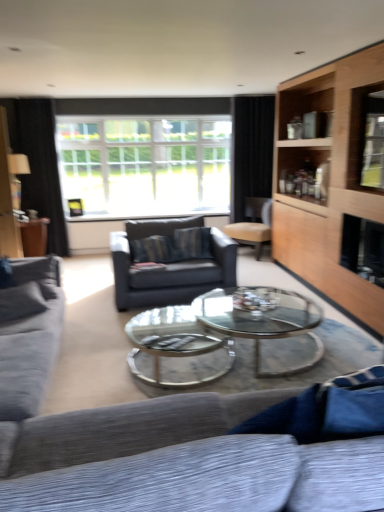
What do you see at coordinates (147, 126) in the screenshot? This screenshot has width=384, height=512. I see `clear glass window at center` at bounding box center [147, 126].

Identify the location of textured gray couch at left, arranged as the 1th studio couch when viewed from the left. (29, 334).

How much space does textured gray couch at lower center, which is the second studio couch in left-to-right order, occupy vertically?

The height of textured gray couch at lower center, which is the second studio couch in left-to-right order, is 31.72 inches.

How much space does textured gray couch at lower center, which is the first studio couch in right-to-left order, occupy horizontally?

textured gray couch at lower center, which is the first studio couch in right-to-left order, is 3.96 feet wide.

Locate an element on the screen. This screenshot has width=384, height=512. clear glass window at center is located at coordinates (147, 126).

How distant is black fabric curtain at left, which is the 1th curtain from left to right, from clear glass window at center?

3.49 feet.

From a real-world perspective, between black fabric curtain at left, the second curtain when ordered from right to left, and clear glass window at center, who is vertically lower?

black fabric curtain at left, the second curtain when ordered from right to left.

Between black fabric curtain at left, which is the 1th curtain from left to right, and clear glass window at center, which one has larger width?

clear glass window at center.

From the image's perspective, is black fabric curtain at left, the second curtain when ordered from right to left, above or below clear glass window at center?

Clearly, from the image's perspective, black fabric curtain at left, the second curtain when ordered from right to left, is below clear glass window at center.

Can you confirm if light wood cabinet at right is thinner than black fabric curtain at left, the second curtain when ordered from right to left?

No.

What's the angular difference between light wood cabinet at right and black fabric curtain at left, which is the 1th curtain from left to right,'s facing directions?

The angular difference between light wood cabinet at right and black fabric curtain at left, which is the 1th curtain from left to right, is 90.7 degrees.

From their relative heights in the image, would you say light wood cabinet at right is taller or shorter than black fabric curtain at left, which is the 1th curtain from left to right?

light wood cabinet at right is taller than black fabric curtain at left, which is the 1th curtain from left to right.

Can you confirm if textured gray couch at lower center, which is the second studio couch in left-to-right order, is bigger than clear glass window at center?

Yes, textured gray couch at lower center, which is the second studio couch in left-to-right order, is bigger than clear glass window at center.

Could you tell me if textured gray couch at lower center, which is the first studio couch in right-to-left order, is facing clear glass window at center?

Yes, textured gray couch at lower center, which is the first studio couch in right-to-left order, is facing clear glass window at center.

Can you confirm if textured gray couch at lower center, which is the second studio couch in left-to-right order, is thinner than clear glass window at center?

Incorrect, the width of textured gray couch at lower center, which is the second studio couch in left-to-right order, is not less than that of clear glass window at center.

Is the depth of textured gray couch at lower center, which is the second studio couch in left-to-right order, less than that of clear glass window at center?

Yes, it is.

Can you tell me how much black fabric curtain at left, which is the 1th curtain from left to right, and textured gray couch at left, arranged as the 1th studio couch when viewed from the left, differ in facing direction?

The angular difference between black fabric curtain at left, which is the 1th curtain from left to right, and textured gray couch at left, arranged as the 1th studio couch when viewed from the left, is 89.6 degrees.

Which curtain is the 1st one when counting from the back of the textured gray couch at left, arranged as the 1th studio couch when viewed from the left? Please provide its 2D coordinates.

[(39, 164)]

Is black fabric curtain at left, the second curtain when ordered from right to left, facing towards textured gray couch at left, arranged as the 1th studio couch when viewed from the left?

Yes, black fabric curtain at left, the second curtain when ordered from right to left, is turned towards textured gray couch at left, arranged as the 1th studio couch when viewed from the left.

Based on the photo, would you say black fabric curtain at left, the second curtain when ordered from right to left, is to the left or to the right of textured gray couch at left, the 2th studio couch viewed from the right, in the picture?

black fabric curtain at left, the second curtain when ordered from right to left, is positioned on textured gray couch at left, the 2th studio couch viewed from the right,'s left side.

Which object is wider, light wood cabinet at right or textured gray couch at lower center, which is the second studio couch in left-to-right order?

textured gray couch at lower center, which is the second studio couch in left-to-right order.

From a real-world perspective, relative to textured gray couch at lower center, which is the second studio couch in left-to-right order, is light wood cabinet at right vertically above or below?

light wood cabinet at right is situated higher than textured gray couch at lower center, which is the second studio couch in left-to-right order, in the real world.

Is point (380, 313) positioned before point (249, 490)?

No, it is not.

Between point (249, 219) and point (240, 288), which one is positioned behind?

The point (249, 219) is farther from the camera.

Consider the image. Is the position of black fabric curtain at upper right, which ranks as the 2th curtain in left-to-right order, less distant than that of clear glass coffee table at center?

No, black fabric curtain at upper right, which ranks as the 2th curtain in left-to-right order, is further to the viewer.

How many degrees apart are the facing directions of black fabric curtain at upper right, which ranks as the 2th curtain in left-to-right order, and clear glass coffee table at center?

They differ by 92.5 degrees in their facing directions.

I want to click on the 2nd curtain positioned above the clear glass coffee table at center (from a real-world perspective), so click(x=251, y=151).

Is textured gray couch at lower center, which is the first studio couch in right-to-left order, at the back of clear glass window at center?

clear glass window at center is not turned away from textured gray couch at lower center, which is the first studio couch in right-to-left order.

Is point (113, 99) less distant than point (107, 459)?

No.

Can you confirm if clear glass window at center is positioned to the right of textured gray couch at lower center, which is the first studio couch in right-to-left order?

No.

Can you confirm if clear glass window at center is thinner than textured gray couch at lower center, which is the second studio couch in left-to-right order?

Indeed, clear glass window at center has a lesser width compared to textured gray couch at lower center, which is the second studio couch in left-to-right order.

Find the location of a particular element. This screenshot has height=512, width=384. window on the right of black fabric curtain at left, which is the 1th curtain from left to right is located at coordinates (147, 126).

At what (x,y) coordinates should I click in order to perform the action: click on curtain that is the 2nd one when counting leftward from the light wood cabinet at right. Please return your answer as a coordinate pair (x, y). Looking at the image, I should click on (39, 164).

When comparing their distances from textured gray couch at left, arranged as the 1th studio couch when viewed from the left, does clear glass coffee table at center or dark gray fabric swivel chair at center seem closer?

clear glass coffee table at center is closer to textured gray couch at left, arranged as the 1th studio couch when viewed from the left.

Looking at this image, when comparing their distances from light wood cabinet at right, does black fabric curtain at left, the second curtain when ordered from right to left, or textured gray couch at left, arranged as the 1th studio couch when viewed from the left, seem further?

The object further to light wood cabinet at right is black fabric curtain at left, the second curtain when ordered from right to left.

In the scene shown: When comparing their distances from textured gray couch at left, the 2th studio couch viewed from the right, does light wood cabinet at right or beige leather chair at center seem closer?

light wood cabinet at right is closer to textured gray couch at left, the 2th studio couch viewed from the right.

Which object lies further to the anchor point black fabric curtain at upper right, arranged as the first curtain when viewed from the right, clear glass coffee table at center or clear glass window at center?

Based on the image, clear glass coffee table at center appears to be further to black fabric curtain at upper right, arranged as the first curtain when viewed from the right.

Based on their spatial positions, is clear glass coffee table at center or dark gray fabric swivel chair at center further from black fabric curtain at left, which is the 1th curtain from left to right?

clear glass coffee table at center is positioned further to the anchor black fabric curtain at left, which is the 1th curtain from left to right.

When comparing their distances from textured gray couch at lower center, which is the first studio couch in right-to-left order, does clear glass window at center or textured gray couch at left, arranged as the 1th studio couch when viewed from the left, seem closer?

Based on the image, textured gray couch at left, arranged as the 1th studio couch when viewed from the left, appears to be nearer to textured gray couch at lower center, which is the first studio couch in right-to-left order.

When comparing their distances from textured gray couch at left, the 2th studio couch viewed from the right, does light wood cabinet at right or black fabric curtain at upper right, arranged as the first curtain when viewed from the right, seem further?

Based on the image, black fabric curtain at upper right, arranged as the first curtain when viewed from the right, appears to be further to textured gray couch at left, the 2th studio couch viewed from the right.

From the image, which object appears to be nearer to dark gray fabric swivel chair at center, beige leather chair at center or black fabric curtain at upper right, which ranks as the 2th curtain in left-to-right order?

beige leather chair at center is closer to dark gray fabric swivel chair at center.

You are a GUI agent. You are given a task and a screenshot of the screen. Output one action in this format:
    pyautogui.click(x=<x>, y=<y>)
    Task: Click on the curtain between textured gray couch at lower center, which is the first studio couch in right-to-left order, and black fabric curtain at upper right, arranged as the first curtain when viewed from the right, along the z-axis
    
    Given the screenshot: What is the action you would take?
    pyautogui.click(x=39, y=164)

Identify the location of chair between textured gray couch at lower center, which is the first studio couch in right-to-left order, and black fabric curtain at upper right, arranged as the first curtain when viewed from the right, along the z-axis. point(253,225).

Locate an element on the screen. The width and height of the screenshot is (384, 512). swivel chair between textured gray couch at left, the 2th studio couch viewed from the right, and beige leather chair at center in the front-back direction is located at coordinates (169, 267).

The image size is (384, 512). What are the coordinates of `swivel chair between clear glass coffee table at center and black fabric curtain at upper right, arranged as the first curtain when viewed from the right, from front to back` in the screenshot? It's located at (169, 267).